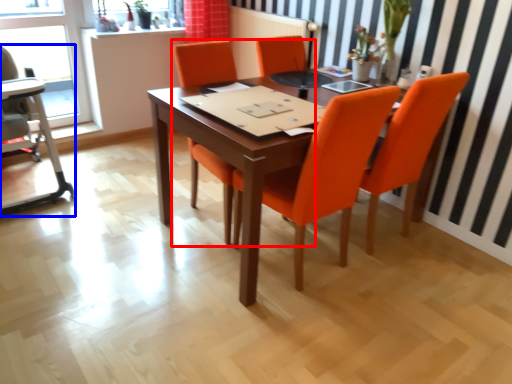
Question: Which of the following is the closest to the observer, chair (highlighted by a red box) or armchair (highlighted by a blue box)?

Choices:
 (A) chair
 (B) armchair

Answer: (A)